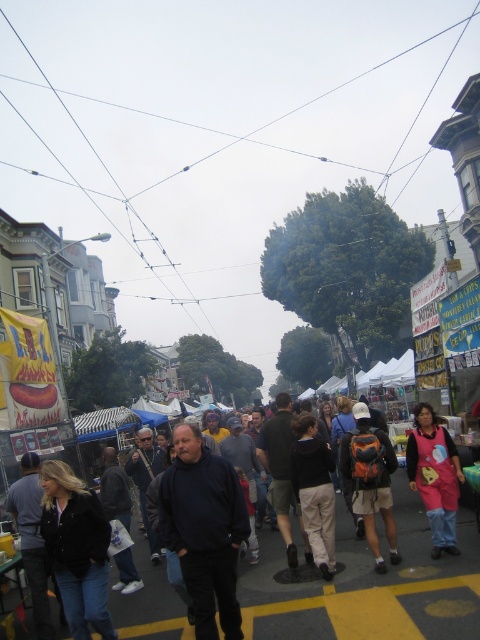
You are a delivery person carrying a large box that is 4 feet wide. You need to navigate through the crowd between the dark blue sweatshirt at center and the pink fabric costume at lower right. Can you pass through without bumping into either of them?

The dark blue sweatshirt at center is 3.56 feet away from the pink fabric costume at lower right. Since your box is 4 feet wide, it is slightly wider than the available space between them. You might need to wait for the crowd to thin or find an alternative path to avoid collision.

You are a photographer standing at the edge of the street fair. You want to take a photo that includes both the dark blue sweatshirt at center and the pink fabric costume at lower right. Which object should you position closer to the foreground to ensure both are in focus?

You should position the pink fabric costume at lower right closer to the foreground because it is taller than the dark blue sweatshirt at center, ensuring both are in focus when using a shallow depth of field.

You are standing at the entrance of the street fair and see the dark blue sweatshirt at center. If you walk straight ahead, will you reach the sweatshirt before reaching the BBQ stall?

The dark blue sweatshirt at center is located at point (368, 586), so the sweatshirt is closer to you than the BBQ stall. Therefore, you will reach the sweatshirt before the BBQ stall.